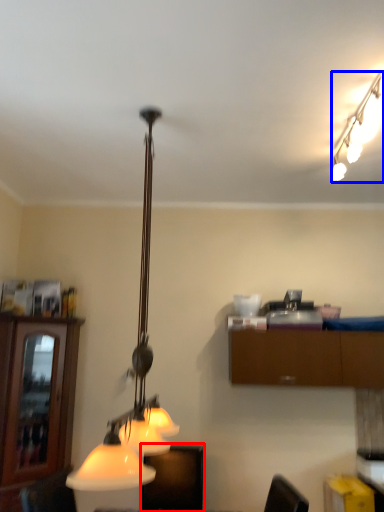
Question: Which point is further to the camera, furniture (highlighted by a red box) or lamp (highlighted by a blue box)?

Choices:
 (A) furniture
 (B) lamp

Answer: (A)